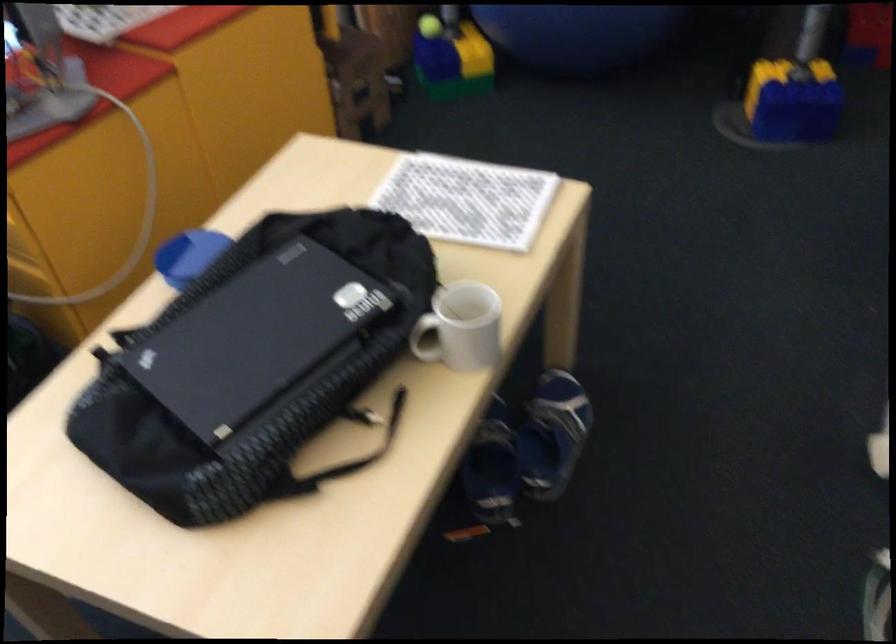
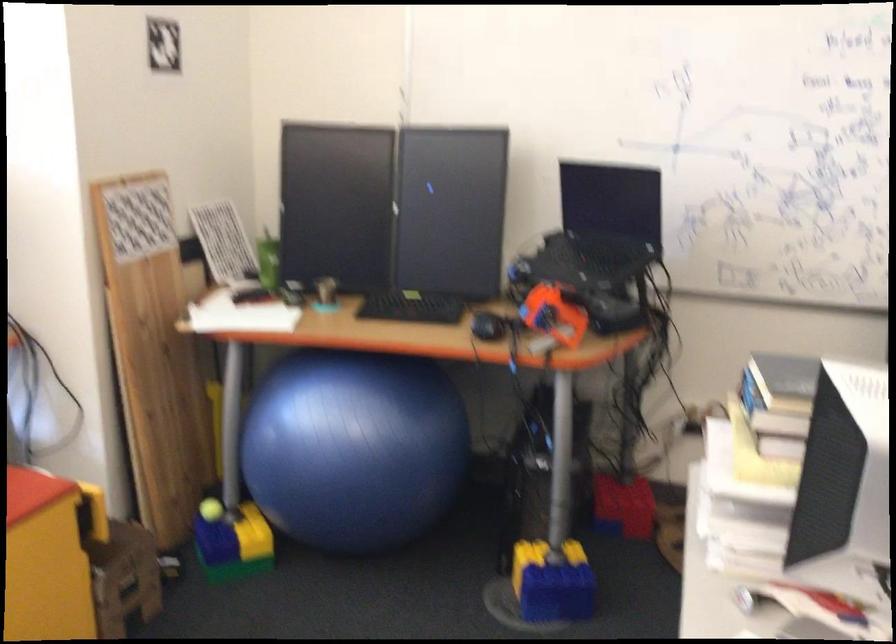
In a continuous first-person perspective shot, in which direction is the camera moving?

The cameraman moved toward right, backward.